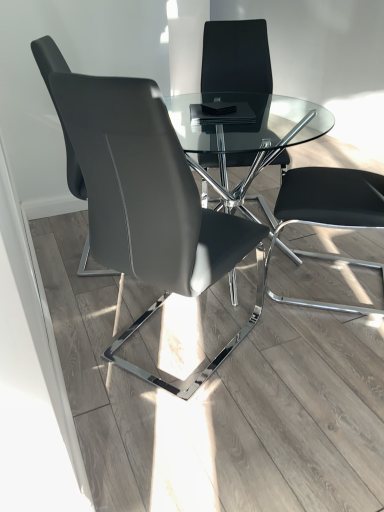
Where is `vacant space in matte black chair at center, positioned as the third chair in back-to-front order (from a real-world perspective)`? vacant space in matte black chair at center, positioned as the third chair in back-to-front order (from a real-world perspective) is located at coordinates (170, 349).